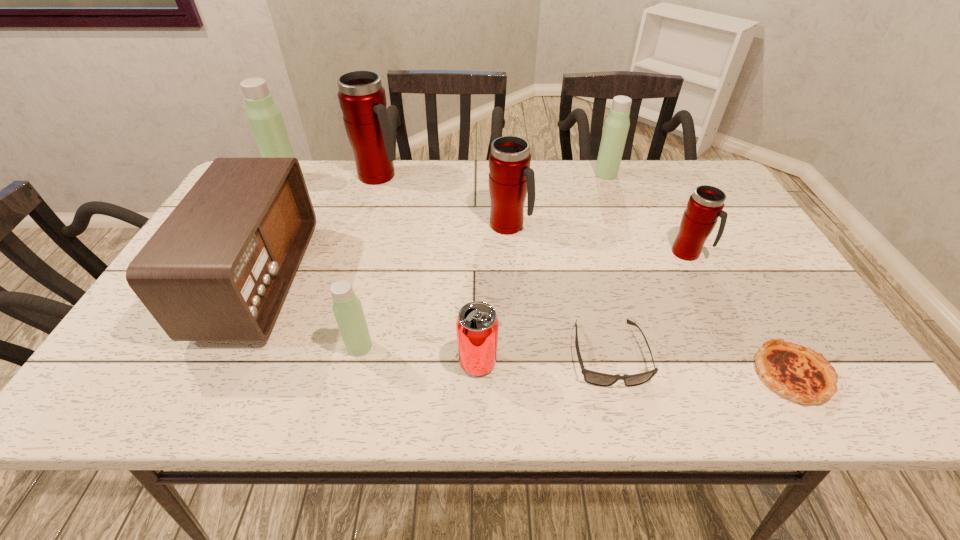
At what (x,y) coordinates should I click in order to perform the action: click on free space between the second smallest light thermos bottle and the shortest object. Please return your answer as a coordinate pair (x, y). This screenshot has height=540, width=960. Looking at the image, I should click on (699, 274).

The height and width of the screenshot is (540, 960). In order to click on free point between the radio receiver and the second shortest object in this screenshot , I will do `click(434, 318)`.

Find the location of `free spot between the rightmost thermos bottle and the second red thermos bottle from left to right`. free spot between the rightmost thermos bottle and the second red thermos bottle from left to right is located at coordinates (598, 239).

This screenshot has height=540, width=960. I want to click on free area in between the third nearest thermos bottle and the sunglasses, so click(559, 290).

The height and width of the screenshot is (540, 960). In order to click on unoccupied area between the second farthest red thermos bottle and the nearest light thermos bottle in this screenshot , I will do `click(434, 286)`.

Where is `free space between the rightmost red thermos bottle and the third object from right to left`? free space between the rightmost red thermos bottle and the third object from right to left is located at coordinates (647, 213).

Image resolution: width=960 pixels, height=540 pixels. Find the location of `vacant region between the nearest red thermos bottle and the biggest red thermos bottle`. vacant region between the nearest red thermos bottle and the biggest red thermos bottle is located at coordinates (534, 214).

At what (x,y) coordinates should I click in order to perform the action: click on free space between the leftmost thermos bottle and the rightmost red thermos bottle. Please return your answer as a coordinate pair (x, y). Looking at the image, I should click on (487, 216).

The height and width of the screenshot is (540, 960). I want to click on vacant space that is in between the second smallest red thermos bottle and the second shortest object, so click(x=559, y=290).

Where is `vacant space that is in between the fifth thermos bottle from left to right and the brown radio receiver`? vacant space that is in between the fifth thermos bottle from left to right and the brown radio receiver is located at coordinates (433, 227).